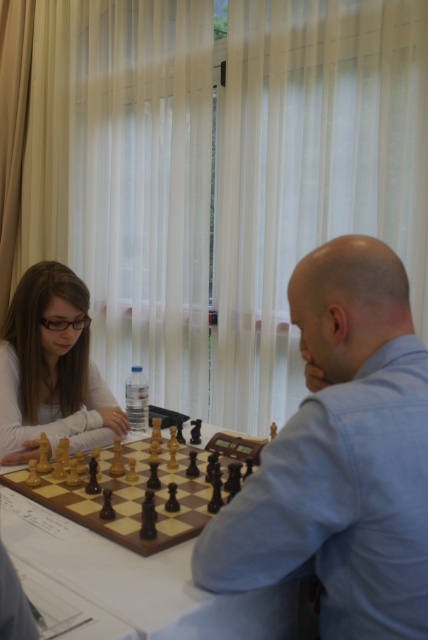
You are a photographer standing in front of the chess table. You want to take a photo of the light blue shirt at center and the matte black hair at left. Which object should you focus on first if you want to capture both in focus without adjusting the camera settings?

The light blue shirt at center has a greater height compared to matte black hair at left, so you should focus on the light blue shirt at center first to ensure both are in focus.

You are a photographer standing in the room and want to take a photo of the light blue shirt at center and the wooden chessboard at center. Which object should you focus on first if you want the one closer to you to be in focus?

The light blue shirt at center is thinner than the wooden chessboard at center, so the wooden chessboard at center is closer to you. Therefore, you should focus on the wooden chessboard at center first to ensure it is in focus.

You are a chess player who wants to place a new chess piece on the wooden chessboard at center. The piece is 50 centimeters tall. Will it fit on the board without touching the matte black hair at left?

The wooden chessboard at center is 49.97 centimeters from matte black hair at left. Since the chess piece is 50 centimeters tall, it would extend beyond the distance between them, potentially touching the matte black hair at left. Therefore, the piece will not fit safely on the board.